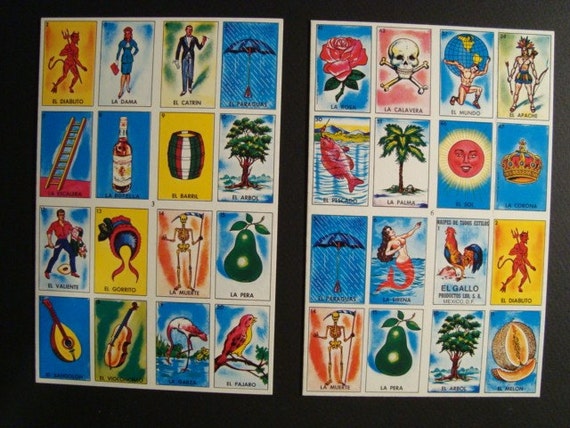
Find the location of a particular element. The width and height of the screenshot is (570, 428). ladder is located at coordinates (62, 152).